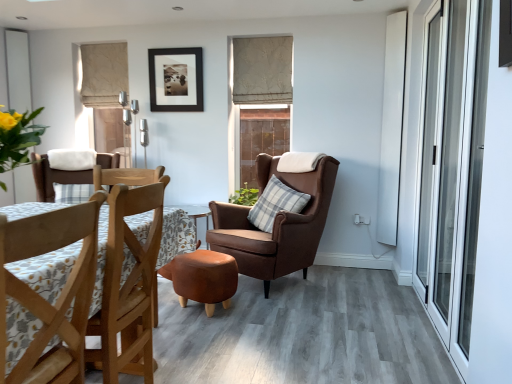
Question: Is transparent glass screen door at right behind white matte window at upper left, the 1th window from the left?

Choices:
 (A) no
 (B) yes

Answer: (A)

Question: Considering the relative sizes of transparent glass screen door at right and white matte window at upper left, the second window when ordered from right to left, in the image provided, is transparent glass screen door at right thinner than white matte window at upper left, the second window when ordered from right to left,?

Choices:
 (A) yes
 (B) no

Answer: (A)

Question: Considering the relative sizes of transparent glass screen door at right and white matte window at upper left, the 1th window from the left, in the image provided, is transparent glass screen door at right bigger than white matte window at upper left, the 1th window from the left,?

Choices:
 (A) yes
 (B) no

Answer: (A)

Question: Are transparent glass screen door at right and white matte window at upper left, the 1th window from the left, located far from each other?

Choices:
 (A) no
 (B) yes

Answer: (B)

Question: Does transparent glass screen door at right turn towards white matte window at upper left, the 1th window from the left?

Choices:
 (A) no
 (B) yes

Answer: (A)

Question: Is brown wooden chair at center, which is the 1th window from right to left, wider or thinner than leather ottoman at center?

Choices:
 (A) thin
 (B) wide

Answer: (A)

Question: From the image's perspective, is brown wooden chair at center, which is the 1th window from right to left, above or below leather ottoman at center?

Choices:
 (A) below
 (B) above

Answer: (B)

Question: Considering the positions of brown wooden chair at center, arranged as the 2th window when viewed from the left, and leather ottoman at center in the image, is brown wooden chair at center, arranged as the 2th window when viewed from the left, taller or shorter than leather ottoman at center?

Choices:
 (A) short
 (B) tall

Answer: (B)

Question: Based on their sizes in the image, would you say brown wooden chair at center, which is the 1th window from right to left, is bigger or smaller than leather ottoman at center?

Choices:
 (A) big
 (B) small

Answer: (B)

Question: Is beige fabric curtain at upper left, which is counted as the second curtain, starting from the right, in front of or behind brown wooden chair at center, which is the 1th window from right to left, in the image?

Choices:
 (A) front
 (B) behind

Answer: (B)

Question: Is beige fabric curtain at upper left, the first curtain positioned from the left, to the left or to the right of brown wooden chair at center, which is the 1th window from right to left, in the image?

Choices:
 (A) right
 (B) left

Answer: (B)

Question: From a real-world perspective, is beige fabric curtain at upper left, which is counted as the second curtain, starting from the right, above or below brown wooden chair at center, arranged as the 2th window when viewed from the left?

Choices:
 (A) above
 (B) below

Answer: (A)

Question: Looking at the image, does beige fabric curtain at upper left, which is counted as the second curtain, starting from the right, seem bigger or smaller compared to brown wooden chair at center, which is the 1th window from right to left?

Choices:
 (A) small
 (B) big

Answer: (B)

Question: Does point (220, 286) appear closer or farther from the camera than point (245, 200)?

Choices:
 (A) closer
 (B) farther

Answer: (A)

Question: Would you say leather ottoman at center is inside or outside green leafy plant at center?

Choices:
 (A) inside
 (B) outside

Answer: (B)